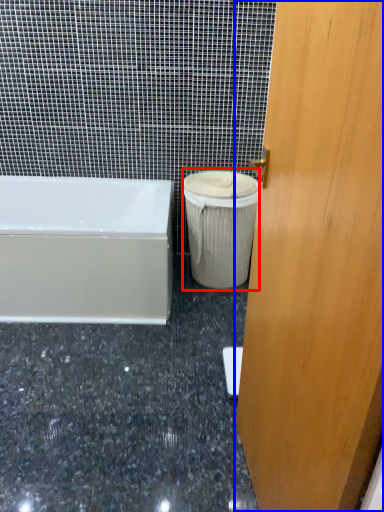
Question: Which object is further to the camera taking this photo, garbage (highlighted by a red box) or door (highlighted by a blue box)?

Choices:
 (A) garbage
 (B) door

Answer: (A)